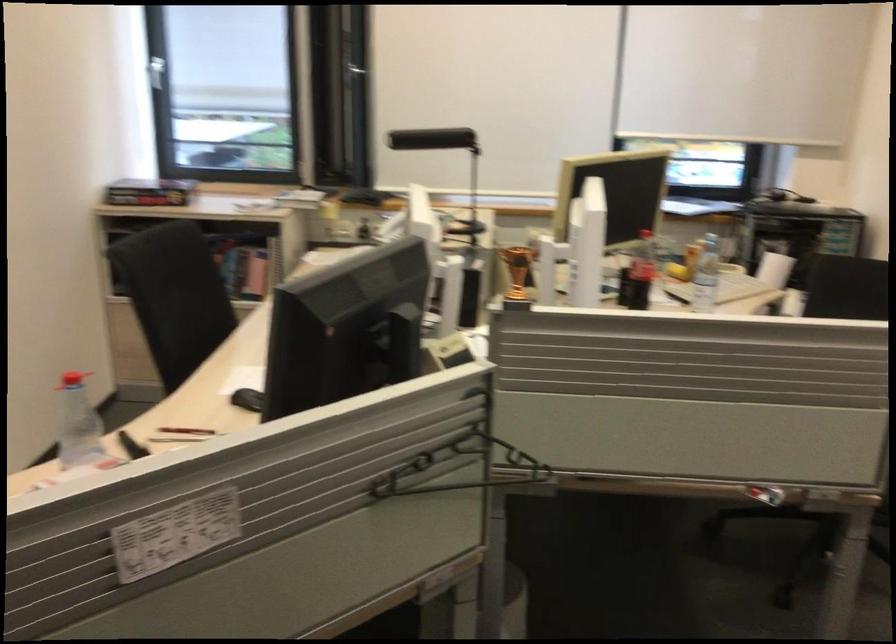
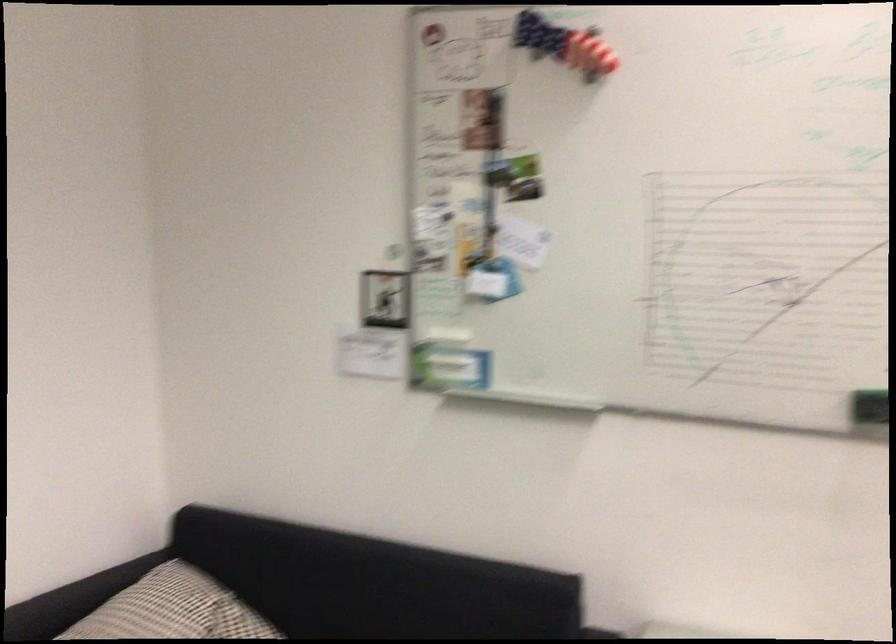
Question: The camera is either moving clockwise (left) or counter-clockwise (right) around the object. The first image is from the beginning of the video and the second image is from the end. Is the camera moving left or right when shooting the video?

Choices:
 (A) Left
 (B) Right

Answer: (B)